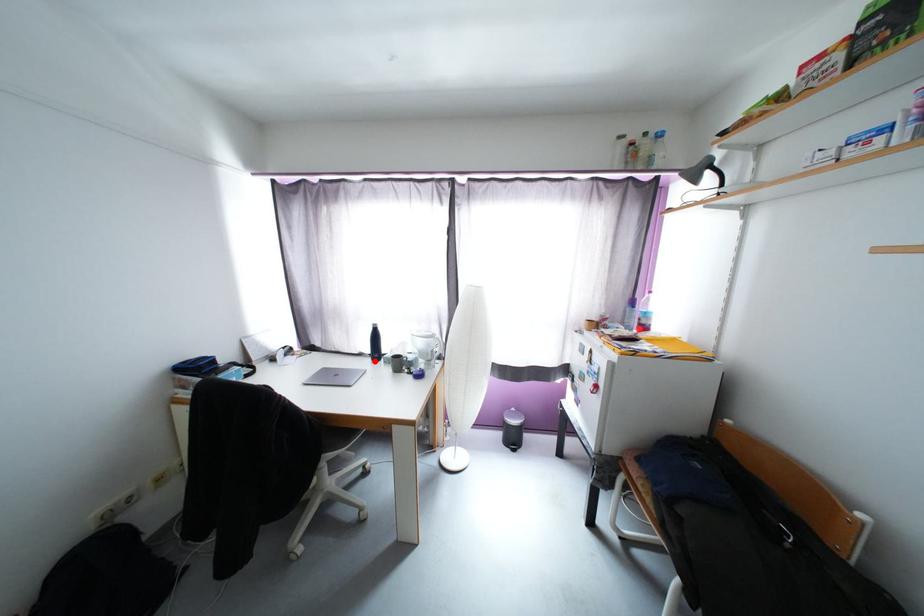
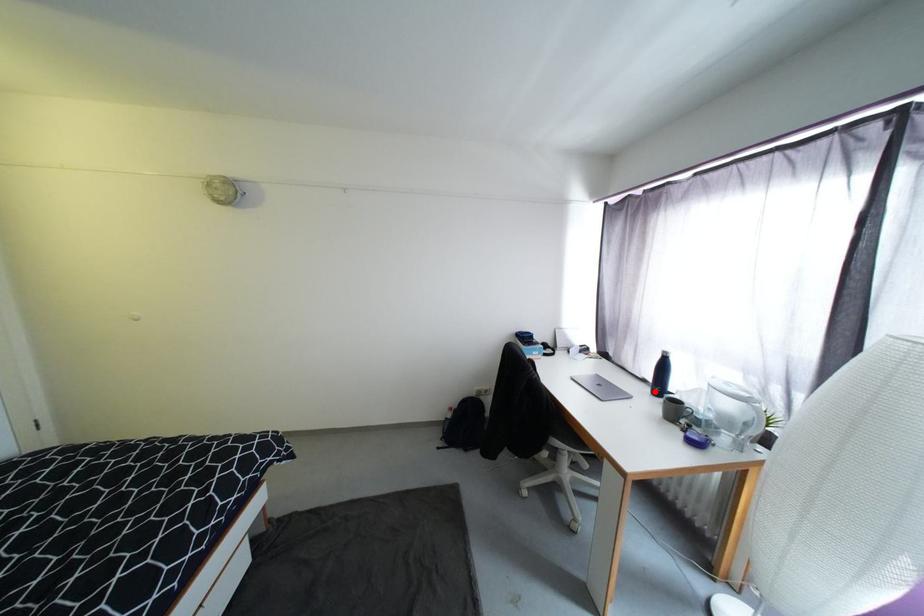
I am providing you with two images of the same scene from different viewpoints. A red point is marked on the first image and another point is marked on the second image. Do the highlighted points in image1 and image2 indicate the same real-world spot?

Yes